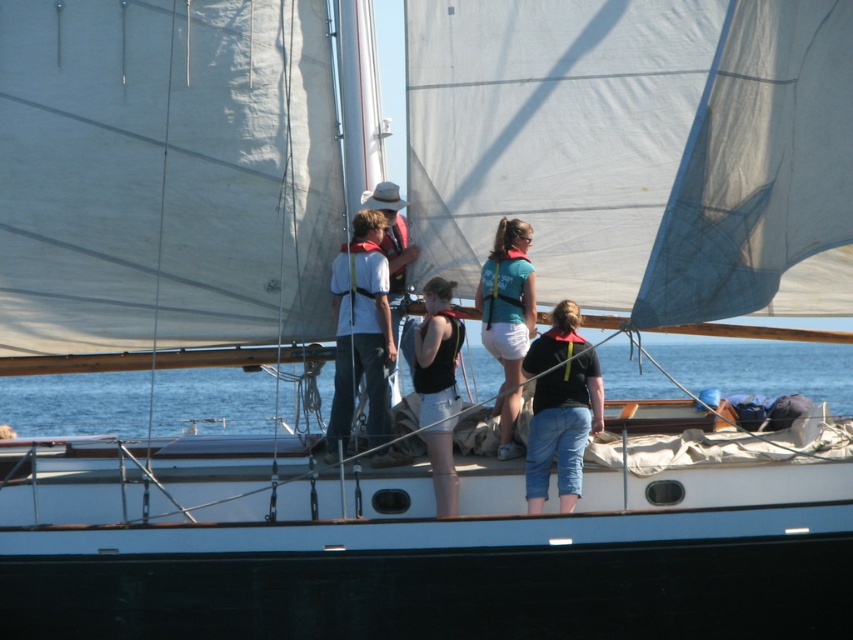
Between black fabric tank top at center and matte white life vest at center, which one appears on the right side from the viewer's perspective?

black fabric tank top at center is more to the right.

Is point (421, 333) farther from viewer compared to point (410, 353)?

That is False.

Locate an element on the screen. This screenshot has height=640, width=853. black fabric tank top at center is located at coordinates (438, 387).

Can you confirm if blue water at center is positioned to the left of matte white shirt at center?

Indeed, blue water at center is positioned on the left side of matte white shirt at center.

Looking at this image, between blue water at center and matte white shirt at center, which one has less height?

Standing shorter between the two is blue water at center.

Does point (3, 404) come closer to viewer compared to point (372, 445)?

No, (3, 404) is behind (372, 445).

You are a GUI agent. You are given a task and a screenshot of the screen. Output one action in this format:
    pyautogui.click(x=<x>, y=<y>)
    Task: Click on the blue water at center
    
    Given the screenshot: What is the action you would take?
    pyautogui.click(x=759, y=365)

Is matte white shirt at center above matte black shirt at center?

Indeed, matte white shirt at center is positioned over matte black shirt at center.

Does matte white shirt at center have a larger size compared to matte black shirt at center?

Yes.

This screenshot has width=853, height=640. I want to click on matte white shirt at center, so click(360, 332).

Image resolution: width=853 pixels, height=640 pixels. Identify the location of matte white shirt at center. (360, 332).